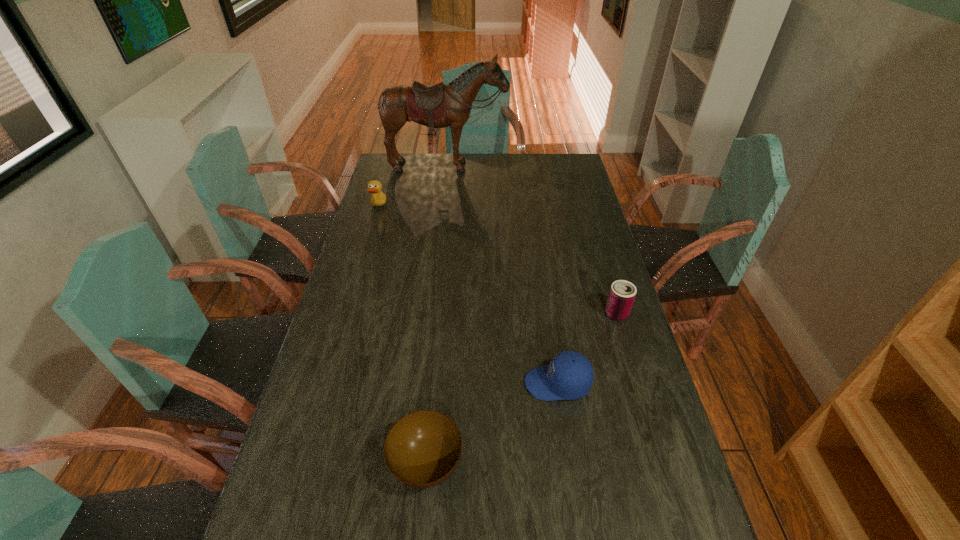
Identify the location of blank space located 0.170m on the front-facing side of the cap. (461, 383).

What are the coordinates of `vacant area situated on the front-facing side of the cap` in the screenshot? It's located at (375, 383).

Identify the location of vacant space located on the front-facing side of the cap. (394, 383).

The height and width of the screenshot is (540, 960). I want to click on free region located 0.230m on the left of the nearest object, so click(291, 465).

Image resolution: width=960 pixels, height=540 pixels. I want to click on object located at the far edge, so click(436, 106).

Where is `saddle located at the left edge`? saddle located at the left edge is located at coordinates (436, 106).

Where is `duck located in the left edge section of the desktop`? This screenshot has width=960, height=540. duck located in the left edge section of the desktop is located at coordinates (378, 198).

Locate an element on the screen. can present at the right edge is located at coordinates click(x=622, y=293).

Identify the location of cap that is at the right edge. The width and height of the screenshot is (960, 540). (569, 376).

Locate an element on the screen. The image size is (960, 540). object present at the far left corner is located at coordinates (436, 106).